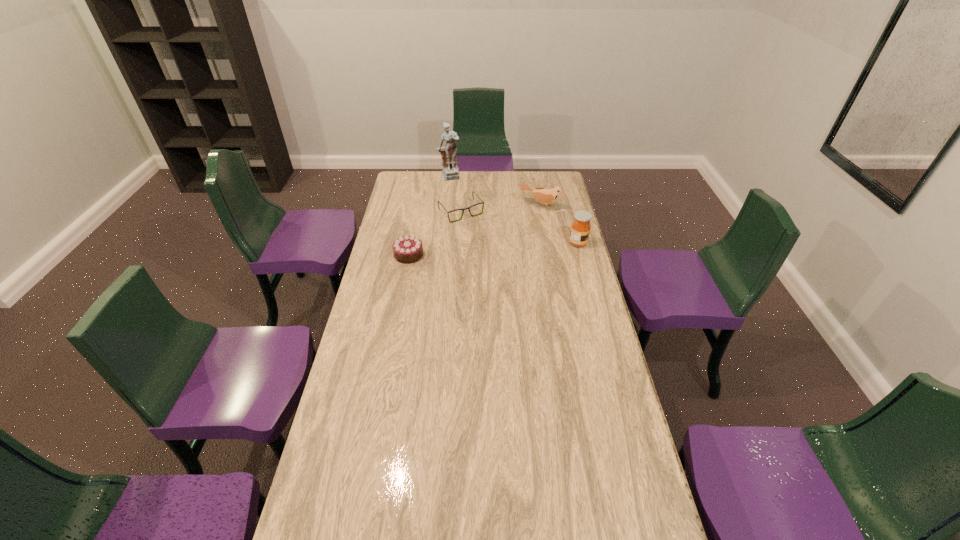
At what (x,y) coordinates should I click in order to perform the action: click on chocolate cake. Please return your answer as a coordinate pair (x, y). Looking at the image, I should click on (408, 249).

In order to click on the second shortest object in this screenshot , I will do `click(408, 249)`.

This screenshot has width=960, height=540. Find the location of `honey`. honey is located at coordinates (580, 229).

The width and height of the screenshot is (960, 540). Find the location of `the third tallest object`. the third tallest object is located at coordinates (546, 196).

Locate an element on the screen. This screenshot has width=960, height=540. the shortest object is located at coordinates (482, 202).

Find the location of a particular element. the farthest object is located at coordinates (450, 171).

Identify the location of figurine. Image resolution: width=960 pixels, height=540 pixels. (450, 171).

Find the location of a particular element. Image resolution: width=960 pixels, height=540 pixels. vacant space situated on the front of the second shortest object is located at coordinates (396, 326).

Identify the location of vacant point located at the beak of the third tallest object. (520, 234).

Where is `free space located at the beak of the third tallest object`? Image resolution: width=960 pixels, height=540 pixels. free space located at the beak of the third tallest object is located at coordinates (522, 231).